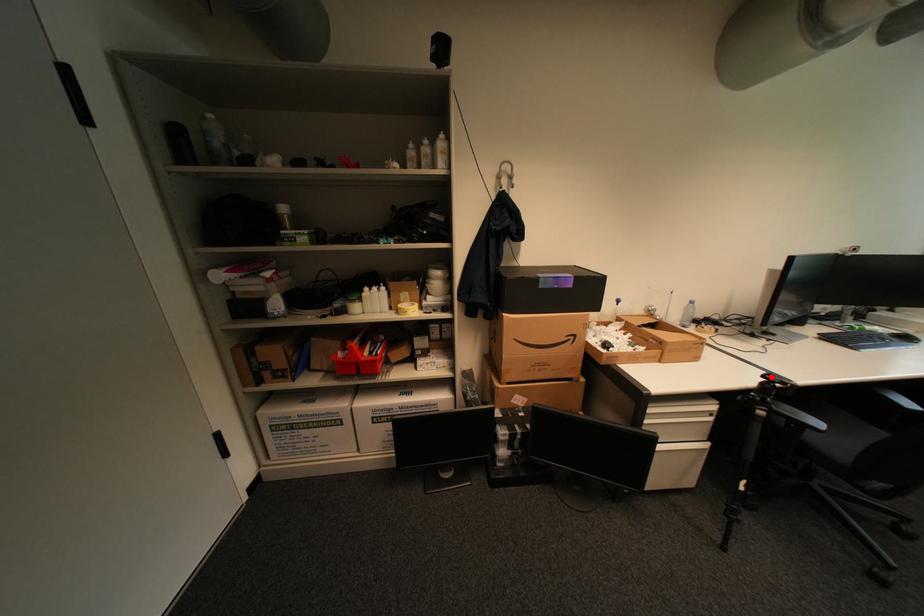
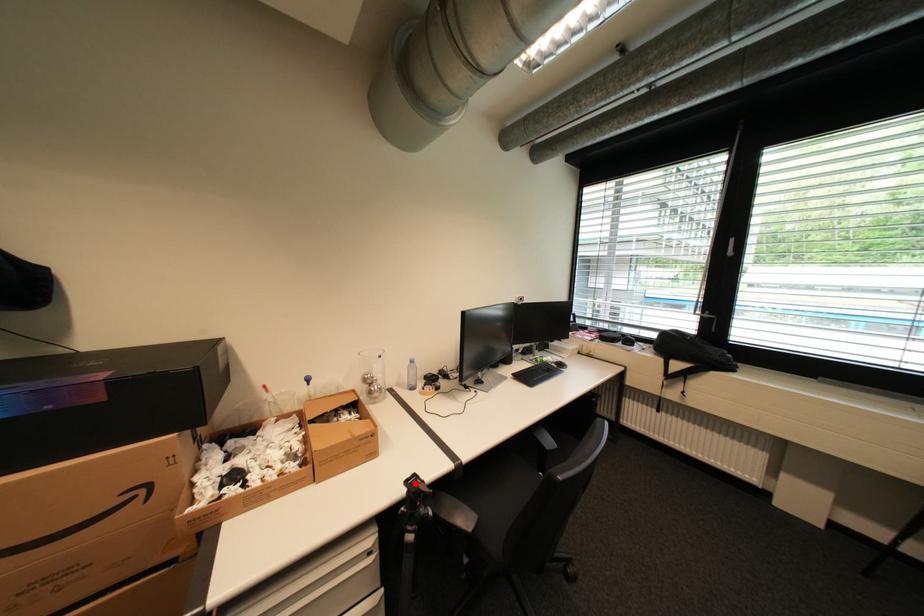
I am providing you with two images of the same scene from different viewpoints. A red point is marked on the first image and another point is marked on the second image. Do the highlighted points in image1 and image2 indicate the same real-world spot?

Yes